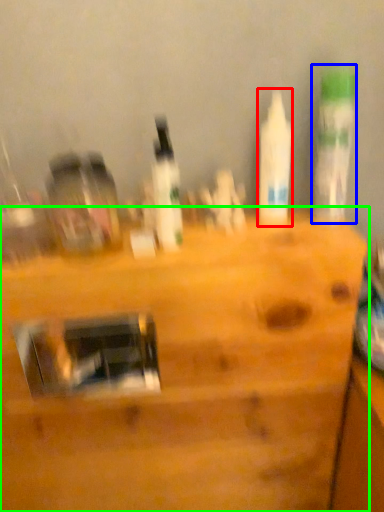
Question: Which object is positioned farthest from bottle (highlighted by a red box)? Select from bottle (highlighted by a blue box) and furniture (highlighted by a green box).

Choices:
 (A) bottle
 (B) furniture

Answer: (B)